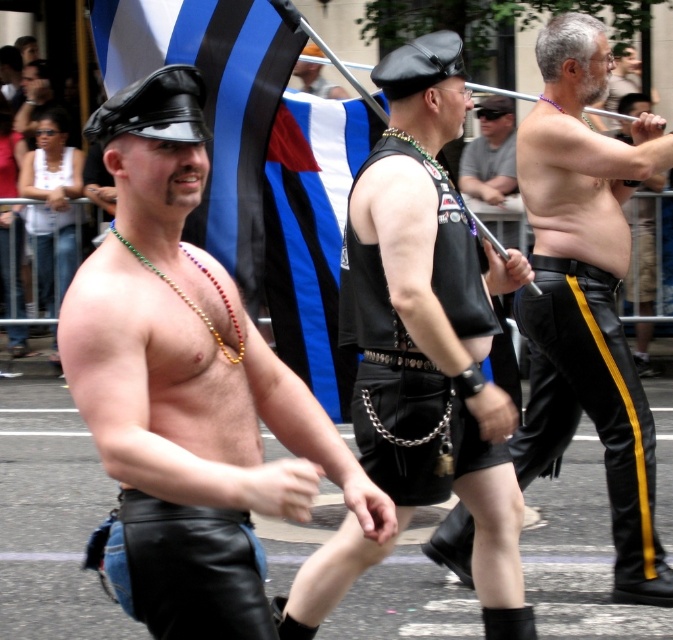
Is black leather pants at center closer to the viewer compared to leather cap at center?

Yes, it is.

Does point (569, 83) lie in front of point (306, 65)?

Yes, point (569, 83) is in front of point (306, 65).

Is point (637, 166) farther from viewer compared to point (320, 65)?

No, it is in front of (320, 65).

The width and height of the screenshot is (673, 640). I want to click on black leather pants at center, so click(x=588, y=292).

Is blue fabric flag at center to the right of matte black vest at center from the viewer's perspective?

No, blue fabric flag at center is not to the right of matte black vest at center.

In the scene shown: Which of these two, blue fabric flag at center or matte black vest at center, stands shorter?

Standing shorter between the two is matte black vest at center.

Which is behind, point (283, 150) or point (495, 124)?

Positioned behind is point (495, 124).

This screenshot has width=673, height=640. What are the coordinates of `blue fabric flag at center` in the screenshot? It's located at (312, 234).

Does shiny black leather shorts at center appear on the left side of black leather pants at center?

Indeed, shiny black leather shorts at center is positioned on the left side of black leather pants at center.

Who is more distant from viewer, (380, 502) or (575, 266)?

Positioned behind is point (575, 266).

Between point (129, 102) and point (577, 205), which one is positioned behind?

Positioned behind is point (577, 205).

Identify the location of shiny black leather shorts at center. This screenshot has width=673, height=640. point(186,388).